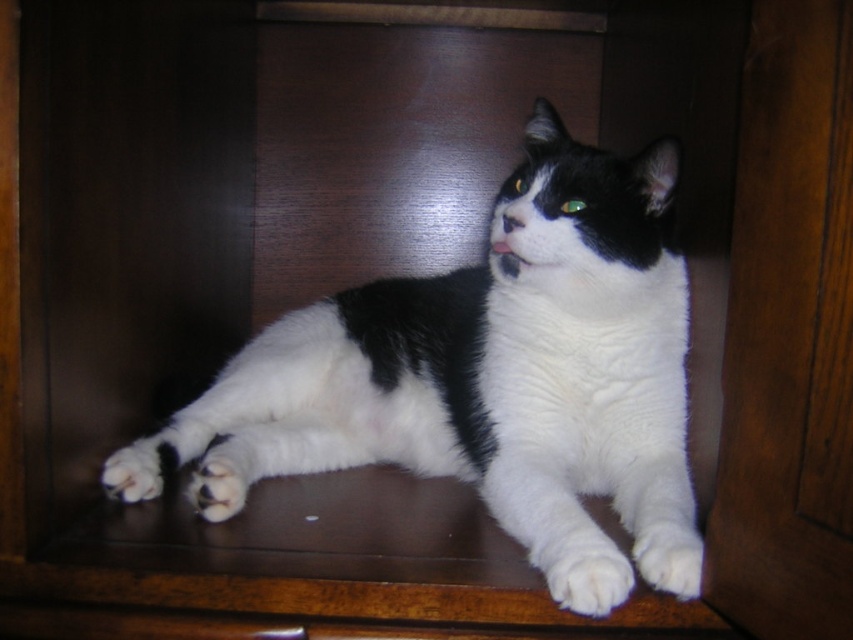
Does black and white fur cat at center appear under white fur at lower center?

No, black and white fur cat at center is not below white fur at lower center.

Which is in front, point (270, 444) or point (202, 506)?

Point (202, 506)

Find the location of `black and white fur cat at center`. black and white fur cat at center is located at coordinates (492, 356).

Is point (643, 540) closer to viewer compared to point (224, 499)?

Yes.

Is point (683, 524) positioned before point (204, 500)?

Yes, it is.

Where is `white fur at lower right`? This screenshot has height=640, width=853. white fur at lower right is located at coordinates (668, 554).

Is black and white fur cat at center to the left of white fur at lower left from the viewer's perspective?

In fact, black and white fur cat at center is to the right of white fur at lower left.

Between black and white fur cat at center and white fur at lower left, which one appears on the left side from the viewer's perspective?

Positioned to the left is white fur at lower left.

Image resolution: width=853 pixels, height=640 pixels. I want to click on black and white fur cat at center, so click(x=492, y=356).